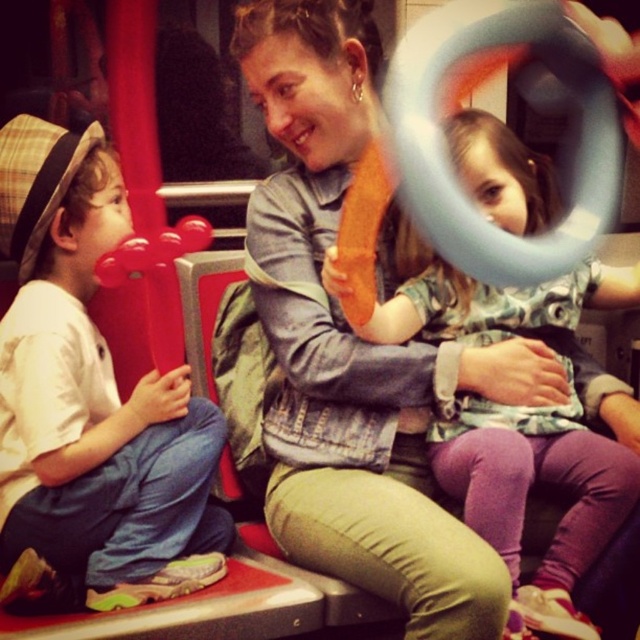
Question: Which point is closer to the camera taking this photo?

Choices:
 (A) (592, 472)
 (B) (173, 420)

Answer: (A)

Question: Which of the following is the farthest from the observer?

Choices:
 (A) (32, 561)
 (B) (488, 516)

Answer: (B)

Question: Does matte red balloon at left lie in front of matte orange balloon at center?

Choices:
 (A) yes
 (B) no

Answer: (B)

Question: Among these points, which one is farthest from the camera?

Choices:
 (A) (568, 317)
 (B) (92, 492)

Answer: (A)

Question: Is matte red balloon at left thinner than matte orange balloon at center?

Choices:
 (A) yes
 (B) no

Answer: (A)

Question: Observing the image, what is the correct spatial positioning of matte red balloon at left in reference to matte orange balloon at center?

Choices:
 (A) below
 (B) above

Answer: (B)